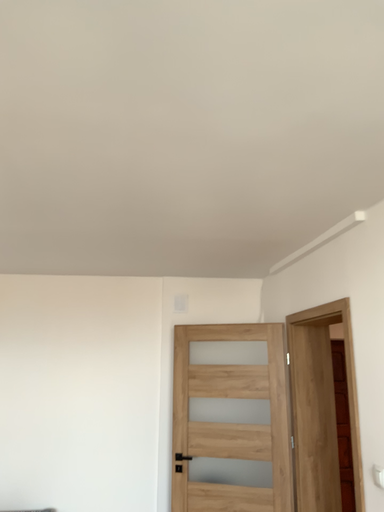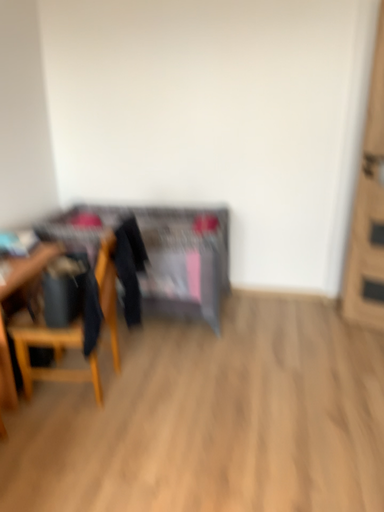
Question: Which way did the camera rotate in the video?

Choices:
 (A) rotated left
 (B) rotated right

Answer: (A)